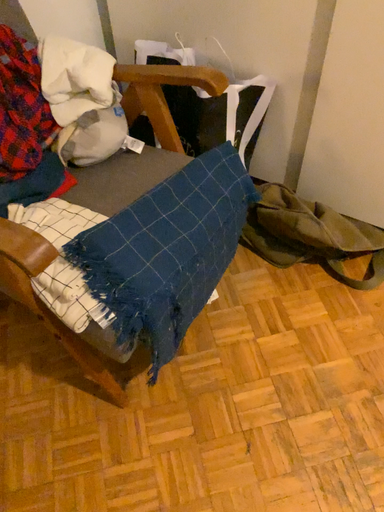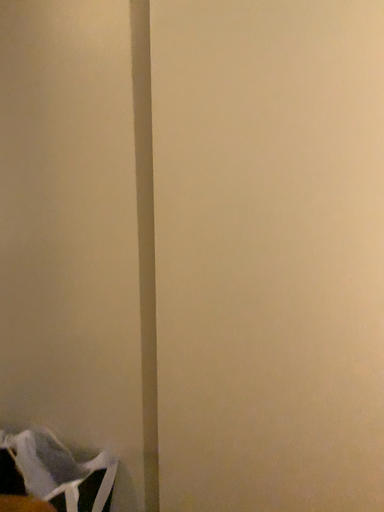
Question: How did the camera likely rotate when shooting the video?

Choices:
 (A) rotated upward
 (B) rotated downward

Answer: (A)